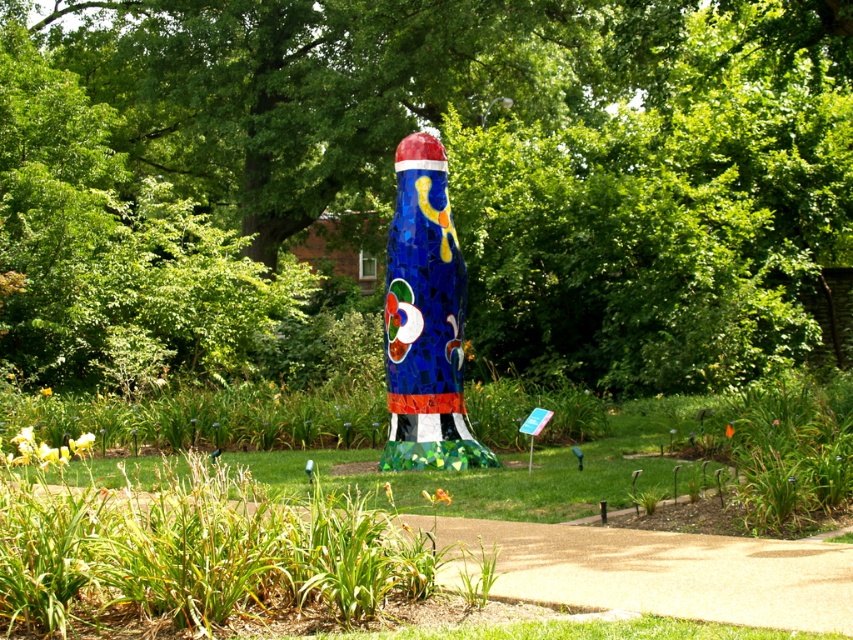
Does mosaic sculpture at center have a lesser height compared to shiny mosaic totem pole at center?

Incorrect, mosaic sculpture at center's height does not fall short of shiny mosaic totem pole at center's.

Is mosaic sculpture at center bigger than shiny mosaic totem pole at center?

Indeed, mosaic sculpture at center has a larger size compared to shiny mosaic totem pole at center.

Locate an element on the screen. mosaic sculpture at center is located at coordinates (450, 177).